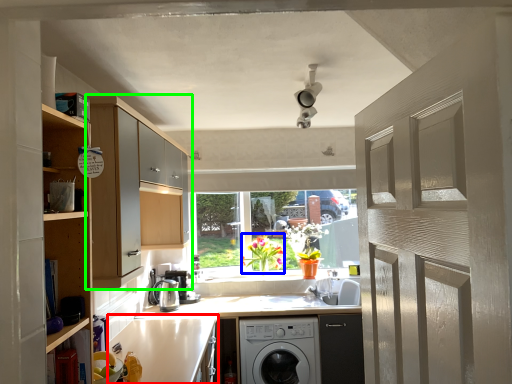
Question: Which is nearer to the counter top (highlighted by a red box)? plant (highlighted by a blue box) or cabinetry (highlighted by a green box).

Choices:
 (A) plant
 (B) cabinetry

Answer: (B)